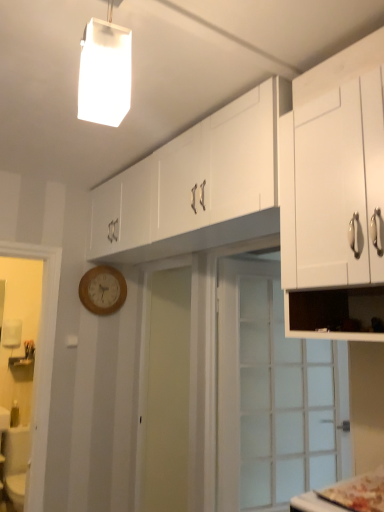
Question: From the image's perspective, would you say wooden clock at center-left is shown under white glossy cabinet at upper center, marked as the second cabinetry in a front-to-back arrangement?

Choices:
 (A) no
 (B) yes

Answer: (B)

Question: Is wooden clock at center-left directly adjacent to white glossy cabinet at upper center, marked as the second cabinetry in a front-to-back arrangement?

Choices:
 (A) yes
 (B) no

Answer: (B)

Question: Considering the relative sizes of wooden clock at center-left and white glossy cabinet at upper center, marked as the second cabinetry in a front-to-back arrangement, in the image provided, is wooden clock at center-left thinner than white glossy cabinet at upper center, marked as the second cabinetry in a front-to-back arrangement,?

Choices:
 (A) yes
 (B) no

Answer: (A)

Question: From a real-world perspective, is wooden clock at center-left under white glossy cabinet at upper center, marked as the second cabinetry in a front-to-back arrangement?

Choices:
 (A) yes
 (B) no

Answer: (A)

Question: Is wooden clock at center-left aimed at white glossy cabinet at upper center, marked as the second cabinetry in a front-to-back arrangement?

Choices:
 (A) yes
 (B) no

Answer: (A)

Question: Does wooden clock at center-left have a greater width compared to white glossy cabinet at upper center, marked as the second cabinetry in a front-to-back arrangement?

Choices:
 (A) no
 (B) yes

Answer: (A)

Question: Could you tell me if white matte cabinet at upper right, arranged as the 1th cabinetry when viewed from the front, is turned towards white glossy cabinet at upper center, the 1th cabinetry from the back?

Choices:
 (A) no
 (B) yes

Answer: (A)

Question: Is white matte cabinet at upper right, placed as the 2th cabinetry when sorted from back to front, positioned beyond the bounds of white glossy cabinet at upper center, marked as the second cabinetry in a front-to-back arrangement?

Choices:
 (A) no
 (B) yes

Answer: (B)

Question: From a real-world perspective, is white matte cabinet at upper right, arranged as the 1th cabinetry when viewed from the front, under white glossy cabinet at upper center, marked as the second cabinetry in a front-to-back arrangement?

Choices:
 (A) no
 (B) yes

Answer: (B)

Question: Can you confirm if white matte cabinet at upper right, placed as the 2th cabinetry when sorted from back to front, is thinner than white glossy cabinet at upper center, the 1th cabinetry from the back?

Choices:
 (A) no
 (B) yes

Answer: (B)

Question: Can you confirm if white matte cabinet at upper right, placed as the 2th cabinetry when sorted from back to front, is wider than white glossy cabinet at upper center, marked as the second cabinetry in a front-to-back arrangement?

Choices:
 (A) no
 (B) yes

Answer: (A)

Question: From the image's perspective, is white matte cabinet at upper right, arranged as the 1th cabinetry when viewed from the front, on top of white glossy cabinet at upper center, the 1th cabinetry from the back?

Choices:
 (A) no
 (B) yes

Answer: (A)

Question: Is white matte rectangular light fixture at upper center shorter than wooden clock at center-left?

Choices:
 (A) yes
 (B) no

Answer: (B)